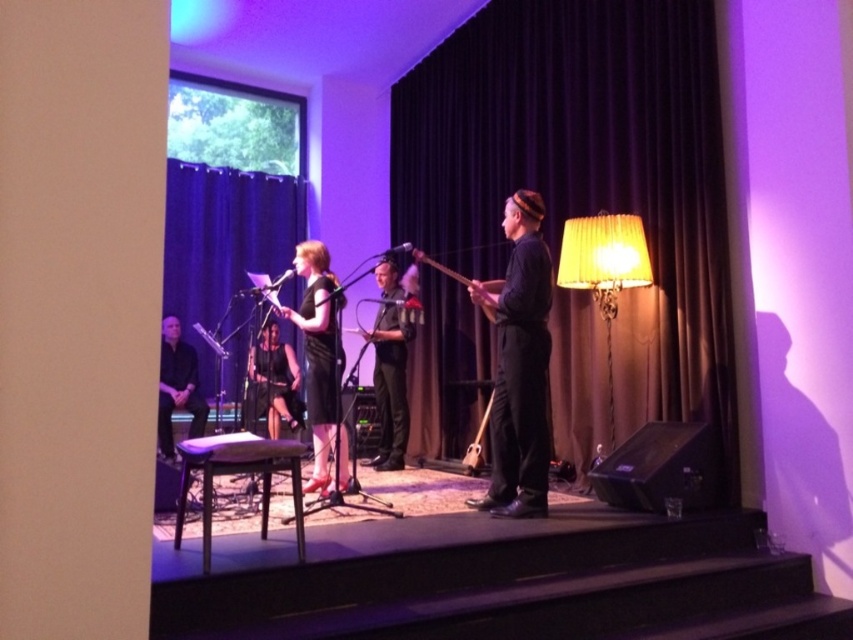
Question: Which of the following is the closest to the observer?

Choices:
 (A) (577, 221)
 (B) (158, 412)
 (C) (486, 314)

Answer: (A)

Question: Does brown velvet curtain at center have a larger size compared to black satin dress at center?

Choices:
 (A) no
 (B) yes

Answer: (B)

Question: Does brown velvet curtain at center have a smaller size compared to gold pleated fabric lampshade at right?

Choices:
 (A) yes
 (B) no

Answer: (B)

Question: Estimate the real-world distances between objects in this image. Which object is closer to the black matte dress at center?

Choices:
 (A) black fabric shirt at center
 (B) black satin dress at center
 (C) dark brown leather hat at center
 (D) purple fabric stool at center

Answer: (D)

Question: Which of these objects is positioned farthest from the black fabric curtain at upper left?

Choices:
 (A) brown velvet curtain at center
 (B) black matte shirt at left

Answer: (A)

Question: Is dark brown leather hat at center thinner than wooden acoustic guitar at center?

Choices:
 (A) yes
 (B) no

Answer: (A)